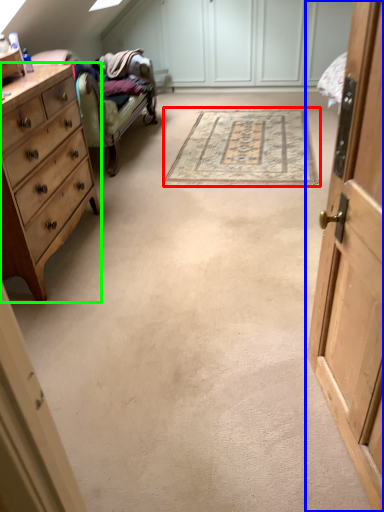
Question: Which object is the closest to the mat (highlighted by a red box)? Choose among these: cabinetry (highlighted by a blue box) or chest of drawers (highlighted by a green box).

Choices:
 (A) cabinetry
 (B) chest of drawers

Answer: (B)